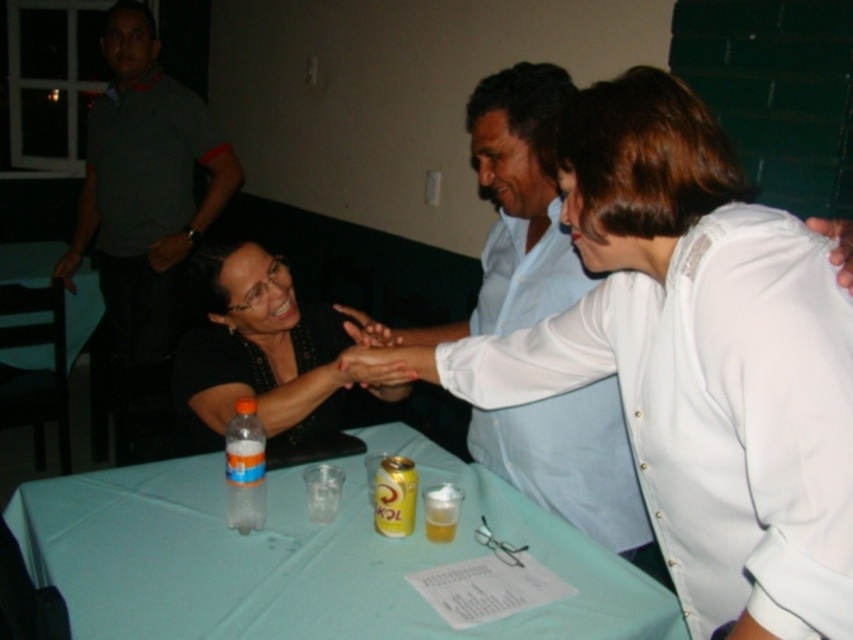
You are at a party and need to place a small gift box on the green plastic table at lower left without it touching the translucent plastic bottle at table left. Is the table tall enough to avoid the bottle?

The green plastic table at lower left has a greater height compared to the translucent plastic bottle at table left, so placing the gift box on the table will not cause it to touch the bottle since the table is taller.

Consider the image. You are standing at the edge of the table looking towards the center. Which of the two points, point (769, 625) or point (561, 564), is closer to you?

Point (769, 625) is closer to the viewer than point (561, 564).